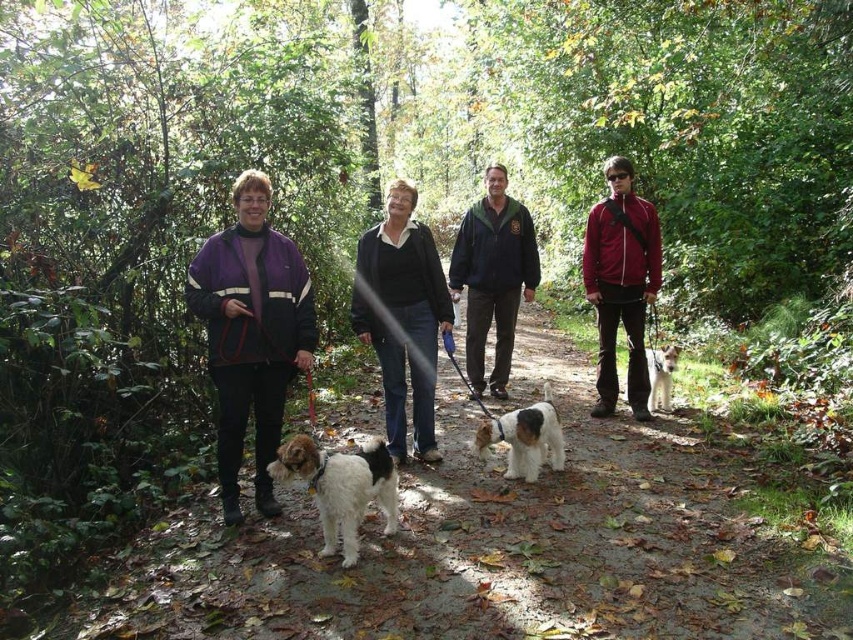
Question: Does matte red jacket at right have a lesser width compared to white fur at center?

Choices:
 (A) no
 (B) yes

Answer: (A)

Question: Does purple fleece jacket at left appear over black sweater at center?

Choices:
 (A) no
 (B) yes

Answer: (A)

Question: Is matte red jacket at right behind white textured dog at center?

Choices:
 (A) yes
 (B) no

Answer: (A)

Question: Which point is farther to the camera?

Choices:
 (A) (424, 388)
 (B) (485, 212)
 (C) (393, 470)

Answer: (B)

Question: Based on their relative distances, which object is nearer to the white fur at center?

Choices:
 (A) matte red jacket at right
 (B) black sweater at center

Answer: (A)

Question: Which object is positioned closest to the purple fleece jacket at left?

Choices:
 (A) green textured jacket at center
 (B) black sweater at center
 (C) white fur at center

Answer: (B)